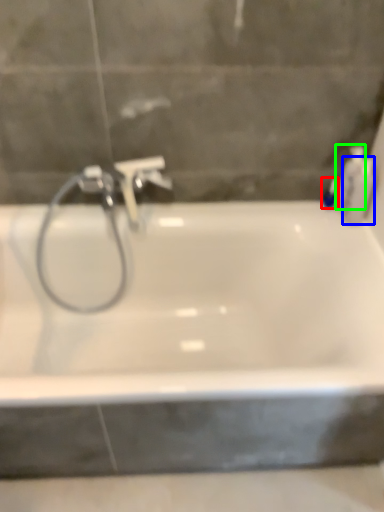
Question: Which object is positioned farthest from toiletry (highlighted by a red box)? Select from toiletry (highlighted by a blue box) and toiletry (highlighted by a green box).

Choices:
 (A) toiletry
 (B) toiletry

Answer: (A)